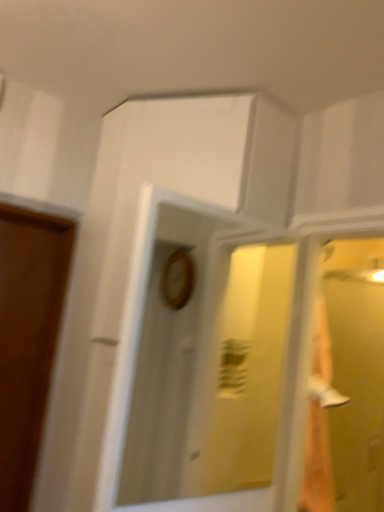
Question: Does point (377, 374) appear closer or farther from the camera than point (127, 288)?

Choices:
 (A) closer
 (B) farther

Answer: (B)

Question: Is transparent glass door at right situated inside wooden clock at center or outside?

Choices:
 (A) inside
 (B) outside

Answer: (B)

Question: In the image, is transparent glass door at right positioned in front of or behind wooden clock at center?

Choices:
 (A) front
 (B) behind

Answer: (B)

Question: Is point (236, 482) closer or farther from the camera than point (350, 497)?

Choices:
 (A) farther
 (B) closer

Answer: (A)

Question: From a real-world perspective, relative to transparent glass door at right, is wooden clock at center vertically above or below?

Choices:
 (A) below
 (B) above

Answer: (B)

Question: Considering their positions, is wooden clock at center located in front of or behind transparent glass door at right?

Choices:
 (A) front
 (B) behind

Answer: (A)

Question: In terms of size, does wooden clock at center appear bigger or smaller than transparent glass door at right?

Choices:
 (A) big
 (B) small

Answer: (B)